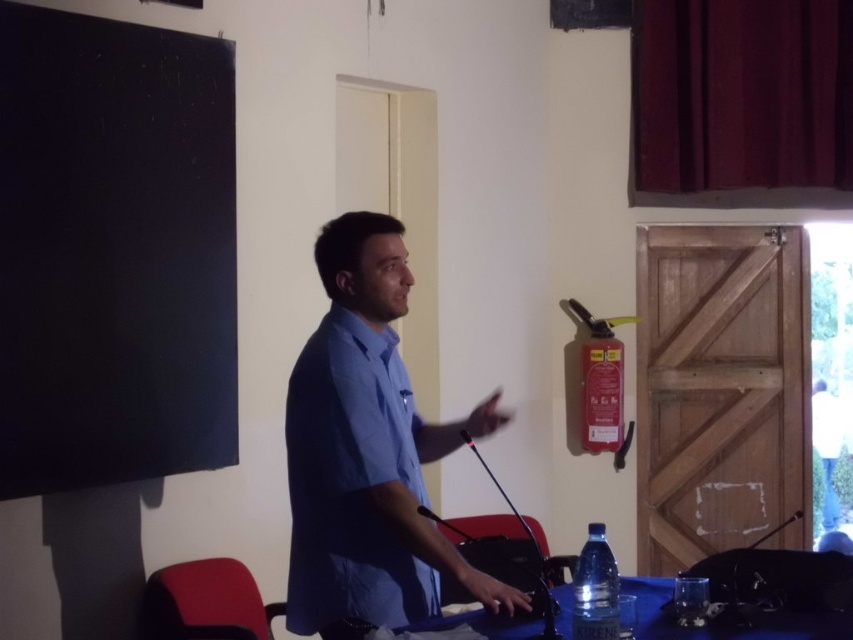
You are standing in the room and want to place a new poster on the wall. You have two options for placement based on coordinates given in the scene. The first option is at point (807, 628) and the second option is at point (784, 520). If you want the poster to be closer to the front of the room, which point should you choose?

Point (807, 628) is in front of point (784, 520), so you should choose point (807, 628) to place the poster closer to the front of the room.

You are organizing a small event and need to place a 15cm tall decorative vase on the table. Considering the height of the blue fabric table at lower center and the black metallic microphone at center, will the vase be stable and not obstruct the microphone?

The blue fabric table at lower center has a lesser height compared to black metallic microphone at center. Since the vase is 15cm tall, placing it on the table won not obstruct the microphone as the table is shorter, allowing the microphone to remain accessible. The stability depends on the table surface, but the height difference ensures the vase won not block the microphone.